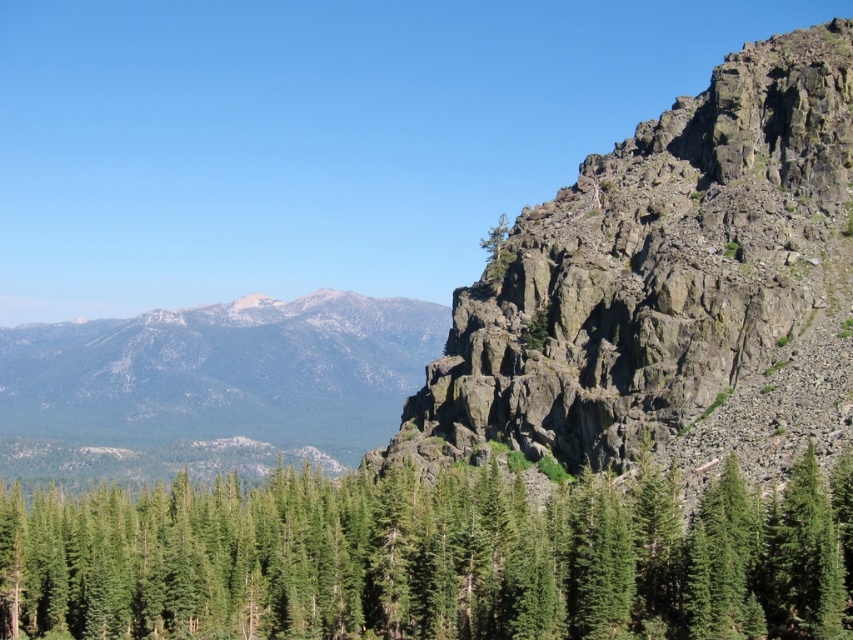
Between green matte tree at center and rugged stone mountain at right, which one is positioned higher?

rugged stone mountain at right is higher up.

The width and height of the screenshot is (853, 640). What do you see at coordinates (431, 557) in the screenshot?
I see `green matte tree at center` at bounding box center [431, 557].

Find the location of `green matte tree at center`. green matte tree at center is located at coordinates (431, 557).